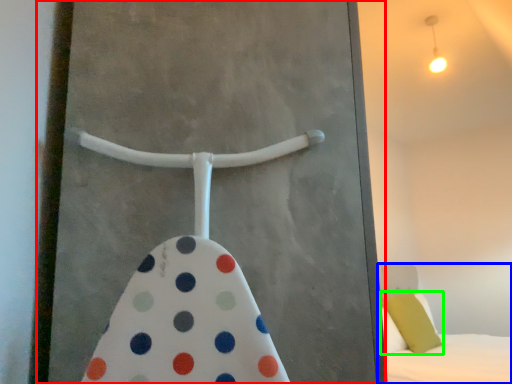
Question: Estimate the real-world distances between objects in this image. Which object is farther from screen door (highlighted by a red box), bed (highlighted by a blue box) or pillow (highlighted by a green box)?

Choices:
 (A) bed
 (B) pillow

Answer: (B)